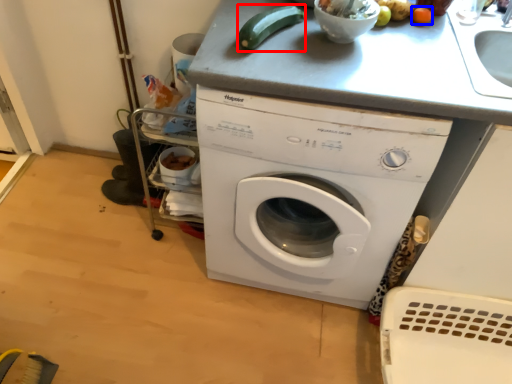
Question: Among these objects, which one is nearest to the camera, vegetable (highlighted by a red box) or vegetable (highlighted by a blue box)?

Choices:
 (A) vegetable
 (B) vegetable

Answer: (A)